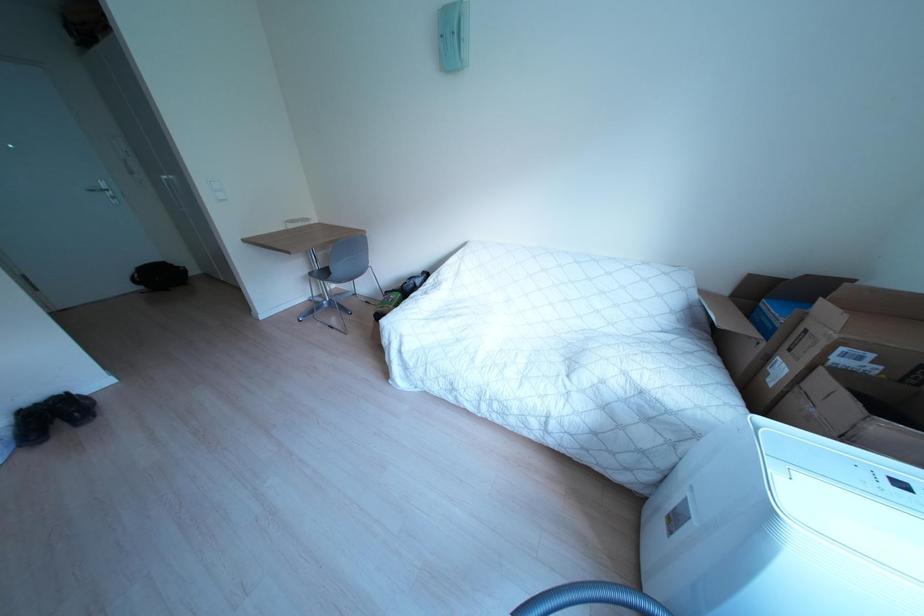
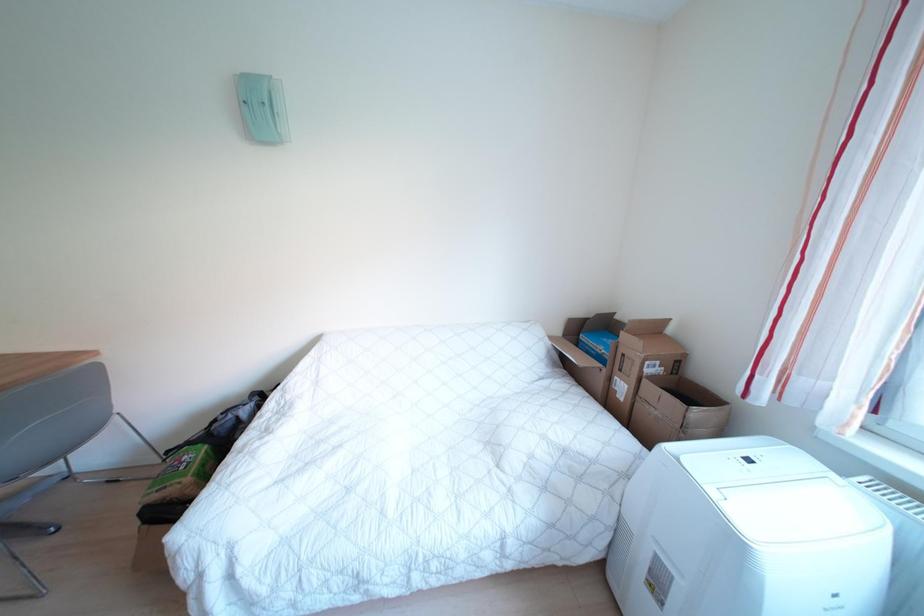
Question: The camera is either moving clockwise (left) or counter-clockwise (right) around the object. The first image is from the beginning of the video and the second image is from the end. Is the camera moving left or right when shooting the video?

Choices:
 (A) Left
 (B) Right

Answer: (A)